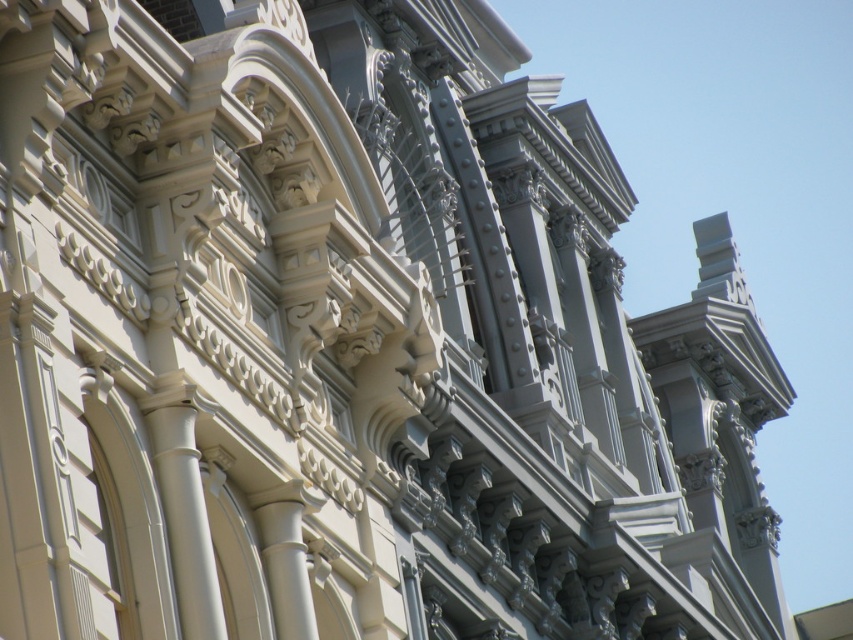
Question: Is white smooth column at left positioned behind white glossy column at center?

Choices:
 (A) yes
 (B) no

Answer: (B)

Question: Is white smooth column at left to the left of white glossy column at center from the viewer's perspective?

Choices:
 (A) no
 (B) yes

Answer: (B)

Question: Does white smooth column at left appear on the left side of white glossy column at center?

Choices:
 (A) yes
 (B) no

Answer: (A)

Question: Which point is farther from the camera taking this photo?

Choices:
 (A) (270, 588)
 (B) (169, 451)

Answer: (A)

Question: Which object appears closest to the camera in this image?

Choices:
 (A) white smooth column at left
 (B) white glossy column at center

Answer: (A)